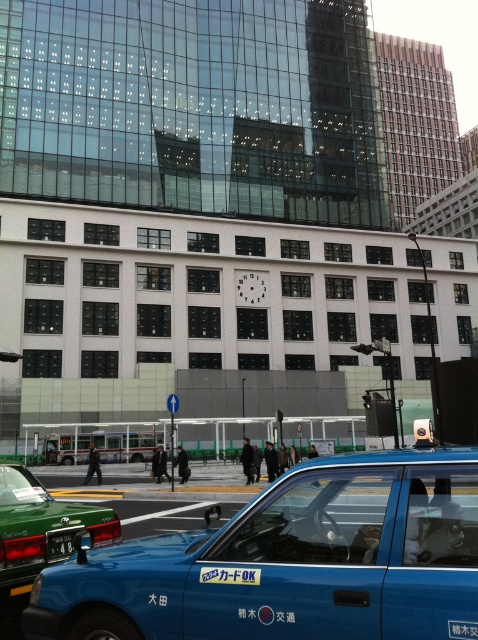
Question: Does blue matte taxi at lower center come behind green matte license plate at lower left?

Choices:
 (A) yes
 (B) no

Answer: (B)

Question: Is blue matte taxi at lower center closer to camera compared to green matte taxi at lower left?

Choices:
 (A) yes
 (B) no

Answer: (A)

Question: Based on their relative distances, which object is farther from the green matte taxi at lower left?

Choices:
 (A) green matte license plate at lower left
 (B) blue matte taxi at lower center

Answer: (B)

Question: Considering the real-world distances, which object is farthest from the blue matte taxi at lower center?

Choices:
 (A) green matte taxi at lower left
 (B) green matte license plate at lower left

Answer: (A)

Question: Estimate the real-world distances between objects in this image. Which object is closer to the blue matte taxi at lower center?

Choices:
 (A) green matte license plate at lower left
 (B) green matte taxi at lower left

Answer: (A)

Question: In this image, where is blue matte taxi at lower center located relative to green matte taxi at lower left?

Choices:
 (A) above
 (B) below

Answer: (A)